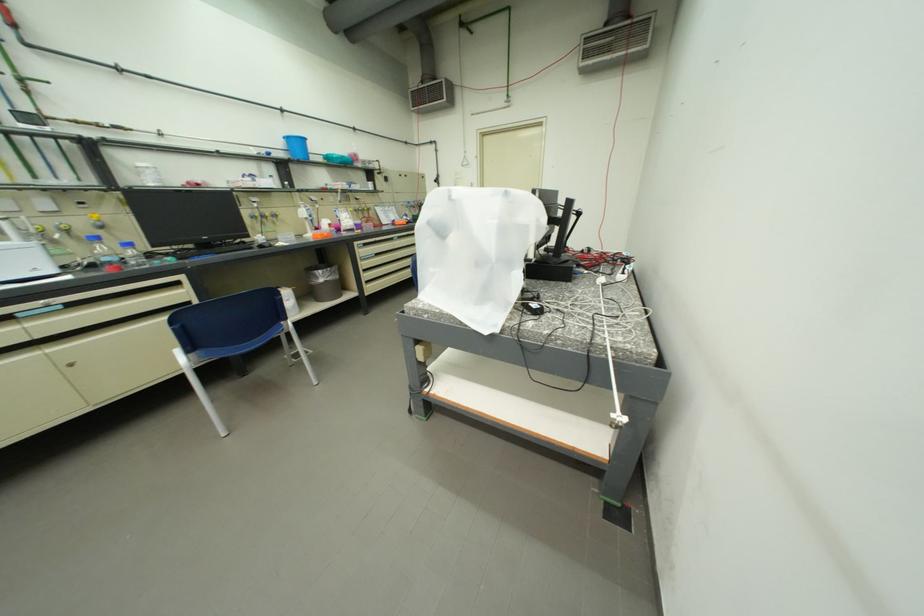
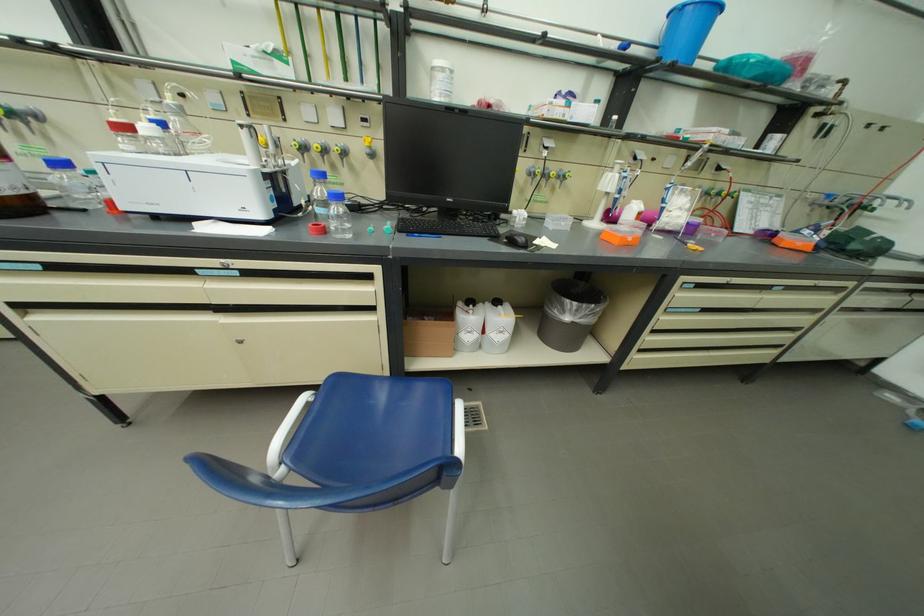
Find the pixel in the second image that matches [275,246] in the first image.

(530, 241)